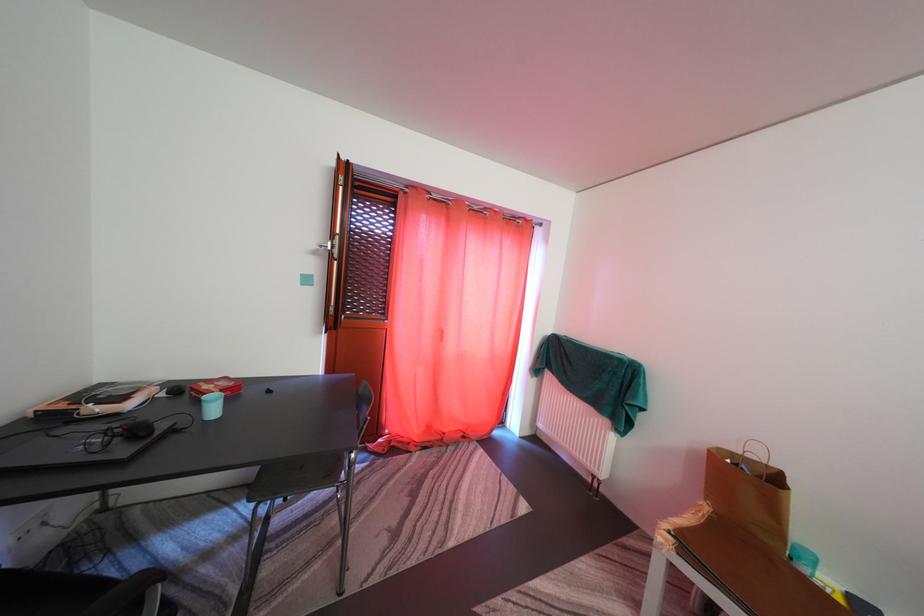
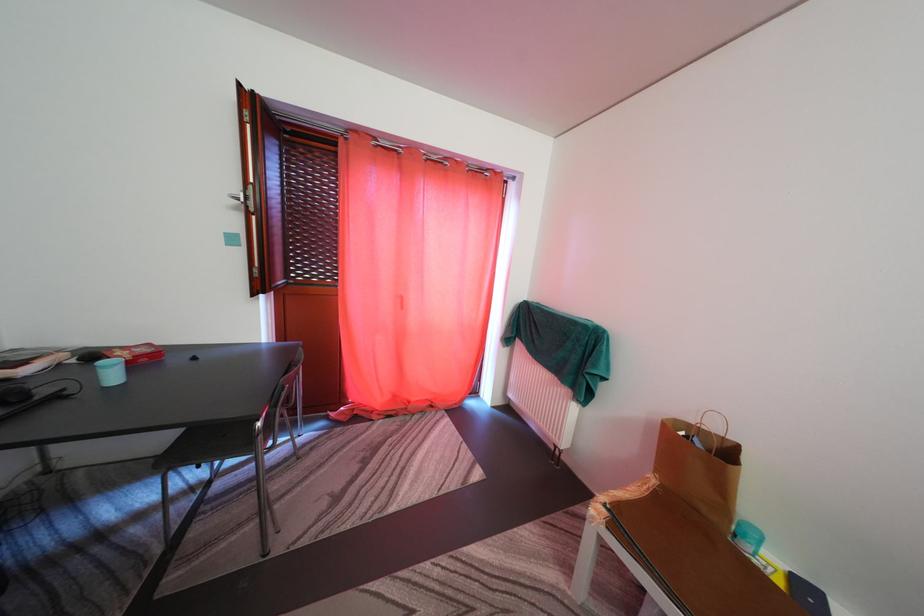
Locate, in the second image, the point that corresponds to point (766, 463) in the first image.

(723, 435)